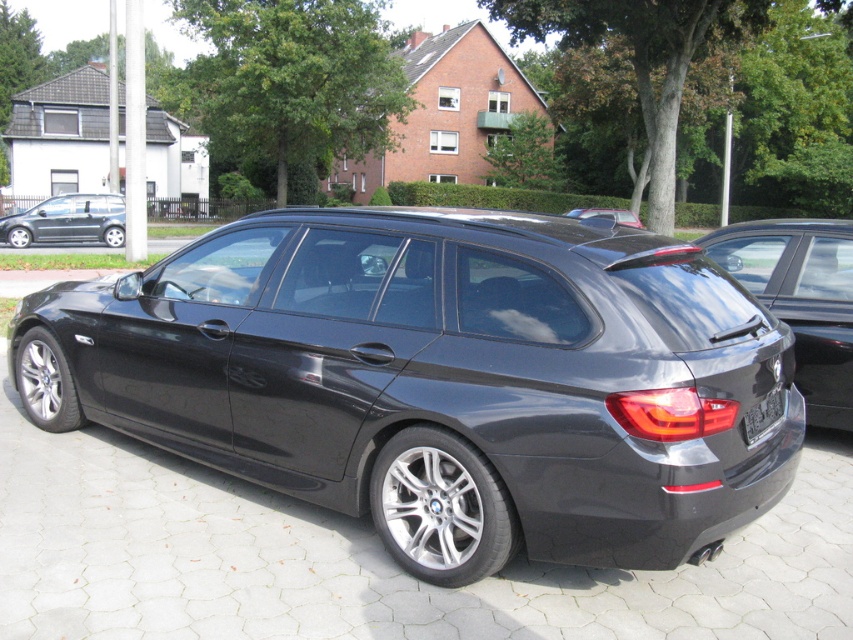
You are standing in the driveway and see the glossy black car at right and the matte gray hatchback at left. Which car is nearer to you?

The glossy black car at right is closer to the viewer than the matte gray hatchback at left.